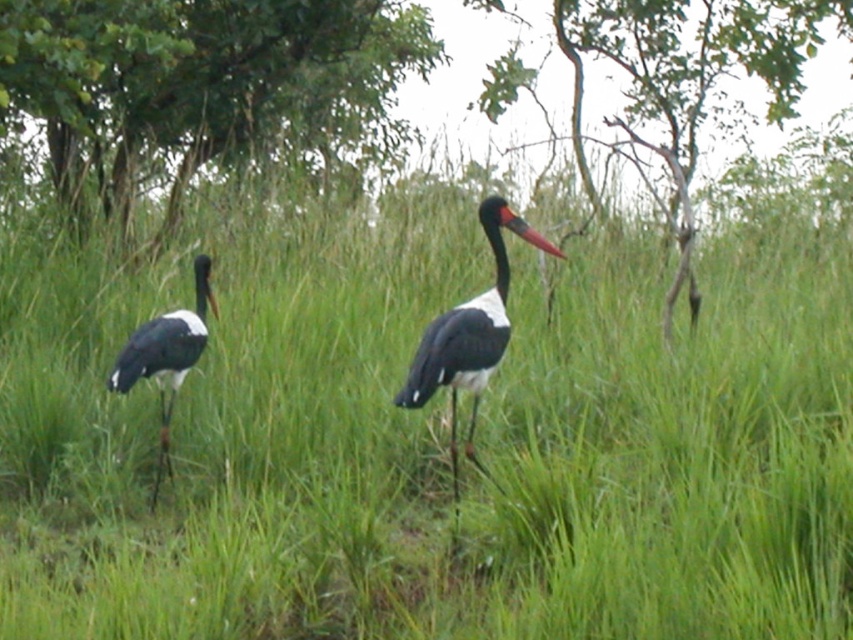
You are standing in the wetland area looking at the scene. There is a point at coordinate (688, 81). What object is located at this point?

The point at coordinate (688, 81) corresponds to the smooth bark tree at upper center.